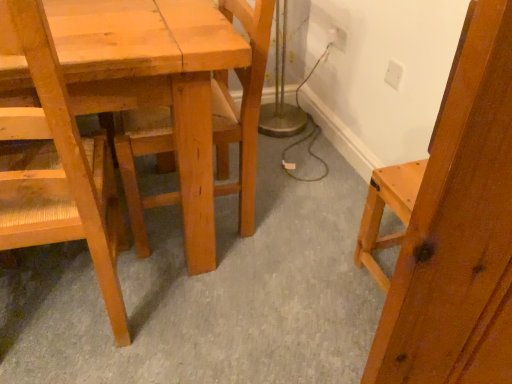
Question: Is white plastic electric outlet at upper right, the first electric outlet viewed from the right, bigger than white plastic electric outlet at upper right, arranged as the 2th electric outlet when viewed from the front?

Choices:
 (A) no
 (B) yes

Answer: (A)

Question: Is white plastic electric outlet at upper right, arranged as the 2th electric outlet when viewed from the back, closer to camera compared to white plastic electric outlet at upper right, the 1th electric outlet from the left?

Choices:
 (A) yes
 (B) no

Answer: (A)

Question: From a real-world perspective, is white plastic electric outlet at upper right, the second electric outlet viewed from the top, located beneath white plastic electric outlet at upper right, which is the second electric outlet in right-to-left order?

Choices:
 (A) no
 (B) yes

Answer: (A)

Question: From the image's perspective, is white plastic electric outlet at upper right, the first electric outlet in the bottom-to-top sequence, beneath white plastic electric outlet at upper right, the 1th electric outlet positioned from the back?

Choices:
 (A) no
 (B) yes

Answer: (B)

Question: Considering the relative sizes of white plastic electric outlet at upper right, arranged as the 2th electric outlet when viewed from the left, and white plastic electric outlet at upper right, positioned as the 1th electric outlet in top-to-bottom order, in the image provided, is white plastic electric outlet at upper right, arranged as the 2th electric outlet when viewed from the left, thinner than white plastic electric outlet at upper right, positioned as the 1th electric outlet in top-to-bottom order,?

Choices:
 (A) yes
 (B) no

Answer: (B)

Question: In the image, is white plastic electric outlet at upper right, the 1th electric outlet from the front, on the left side or the right side of white plastic electric outlet at upper right, which appears as the 2th electric outlet when ordered from the bottom?

Choices:
 (A) left
 (B) right

Answer: (B)

Question: Looking at their shapes, would you say white plastic electric outlet at upper right, arranged as the 2th electric outlet when viewed from the back, is wider or thinner than white plastic electric outlet at upper right, the 1th electric outlet from the left?

Choices:
 (A) wide
 (B) thin

Answer: (A)

Question: Based on their sizes in the image, would you say white plastic electric outlet at upper right, arranged as the 2th electric outlet when viewed from the back, is bigger or smaller than white plastic electric outlet at upper right, arranged as the 2th electric outlet when viewed from the front?

Choices:
 (A) small
 (B) big

Answer: (A)

Question: Considering their positions, is white plastic electric outlet at upper right, arranged as the 2th electric outlet when viewed from the left, located in front of or behind white plastic electric outlet at upper right, which is the second electric outlet in right-to-left order?

Choices:
 (A) front
 (B) behind

Answer: (A)

Question: Considering their positions, is white plastic electric outlet at upper right, the first electric outlet viewed from the right, located in front of or behind natural wood chair at left, the second chair positioned from the right?

Choices:
 (A) front
 (B) behind

Answer: (B)

Question: Based on their sizes in the image, would you say white plastic electric outlet at upper right, the 1th electric outlet from the front, is bigger or smaller than natural wood chair at left, acting as the first chair starting from the left?

Choices:
 (A) small
 (B) big

Answer: (A)

Question: From the image's perspective, is white plastic electric outlet at upper right, the second electric outlet viewed from the top, positioned above or below natural wood chair at left, acting as the first chair starting from the left?

Choices:
 (A) below
 (B) above

Answer: (B)

Question: Looking at their shapes, would you say white plastic electric outlet at upper right, the first electric outlet in the bottom-to-top sequence, is wider or thinner than natural wood chair at left, the second chair positioned from the right?

Choices:
 (A) thin
 (B) wide

Answer: (A)

Question: Considering the positions of point (344, 33) and point (396, 82), is point (344, 33) closer or farther from the camera than point (396, 82)?

Choices:
 (A) farther
 (B) closer

Answer: (A)

Question: In terms of size, does white plastic electric outlet at upper right, which is the second electric outlet in right-to-left order, appear bigger or smaller than white plastic electric outlet at upper right, the first electric outlet in the bottom-to-top sequence?

Choices:
 (A) small
 (B) big

Answer: (B)